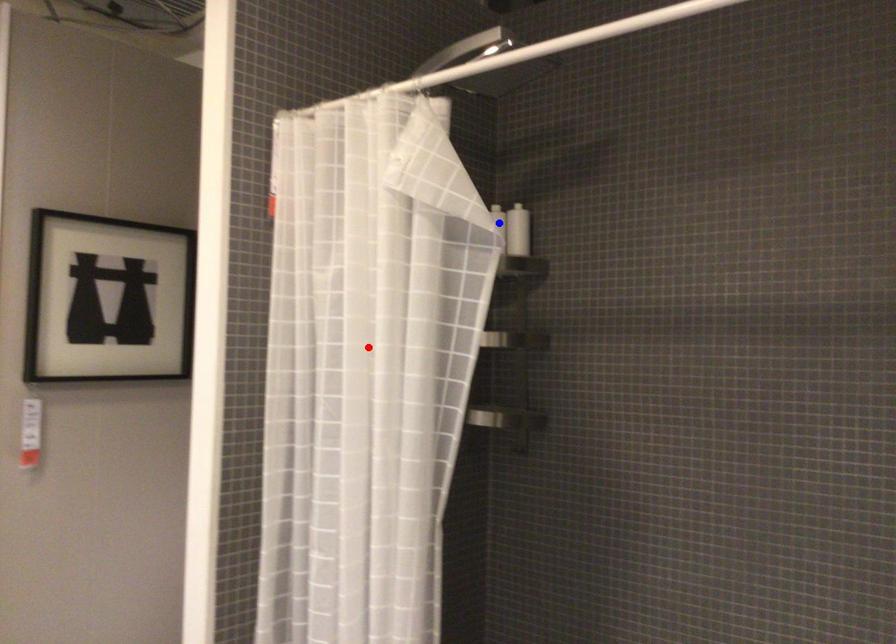
Question: In the image, two points are highlighted. Which point is nearer to the camera? Reply with the corresponding letter.

Choices:
 (A) blue point
 (B) red point

Answer: (B)